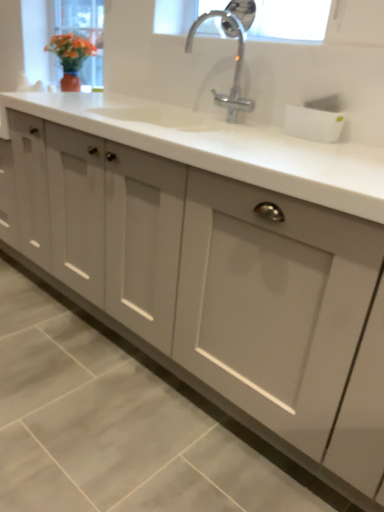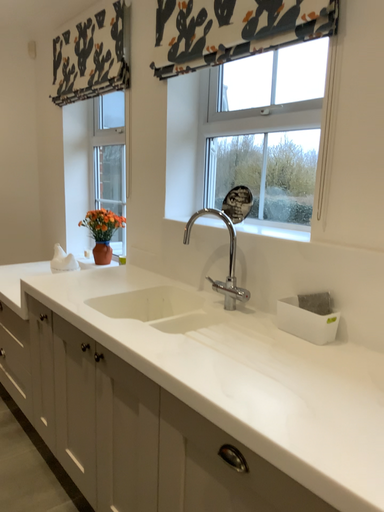
Question: How did the camera likely rotate when shooting the video?

Choices:
 (A) rotated right
 (B) rotated left

Answer: (B)